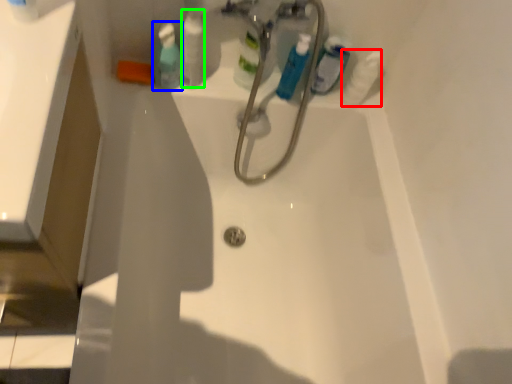
Question: Which object is the closest to the cleaning product (highlighted by a red box)? Choose among these: mouthwash (highlighted by a blue box) or toiletry (highlighted by a green box).

Choices:
 (A) mouthwash
 (B) toiletry

Answer: (B)